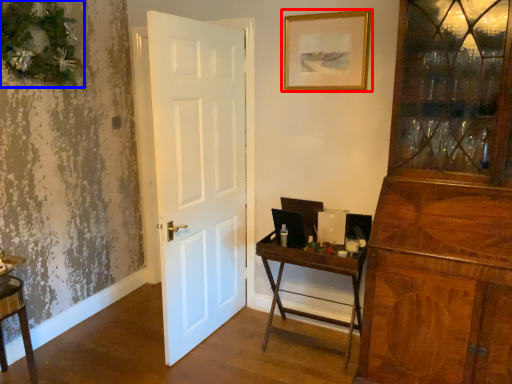
Question: Which object is closer to the camera taking this photo, picture frame (highlighted by a red box) or christmas decoration (highlighted by a blue box)?

Choices:
 (A) picture frame
 (B) christmas decoration

Answer: (B)